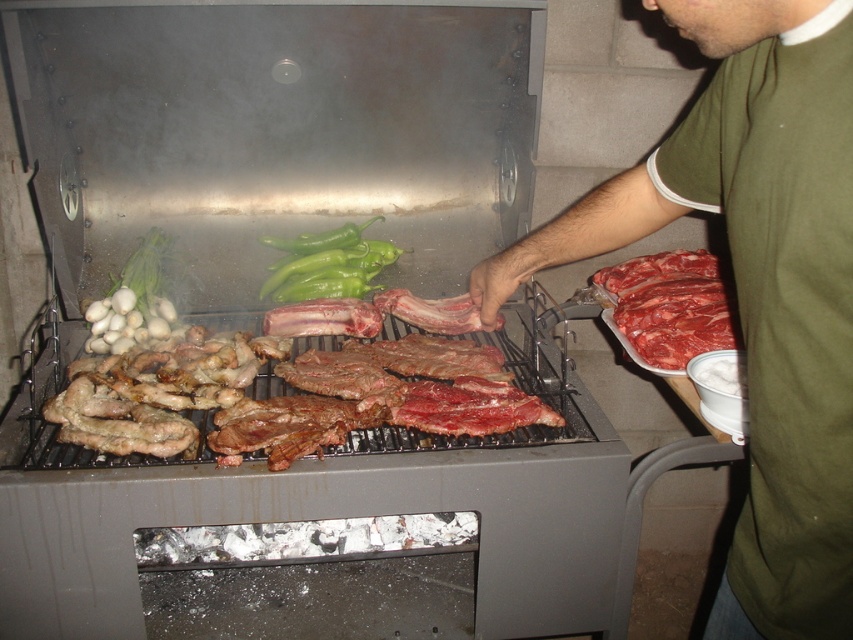
Can you confirm if green glossy peppers at center is wider than green matte onion at upper left?

Indeed, green glossy peppers at center has a greater width compared to green matte onion at upper left.

Consider the image. Between green glossy peppers at center and green matte onion at upper left, which one is positioned lower?

green matte onion at upper left is below.

In order to click on green glossy peppers at center in this screenshot , I will do `click(328, 264)`.

Can you confirm if raw red meat at right is bigger than green glossy peppers at center?

Yes.

Does raw red meat at right have a greater width compared to green glossy peppers at center?

No.

Where is `raw red meat at right`? This screenshot has height=640, width=853. raw red meat at right is located at coordinates (669, 305).

Describe the element at coordinates (669, 305) in the screenshot. This screenshot has width=853, height=640. I see `raw red meat at right` at that location.

Identify the location of raw red meat at right. (669, 305).